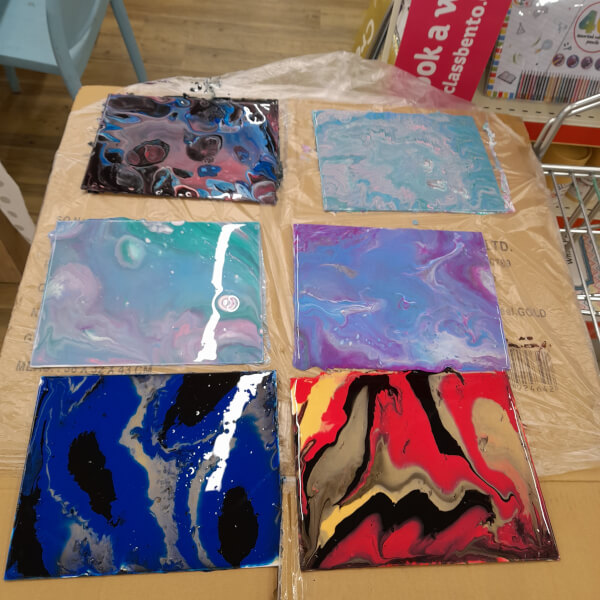
Locate an element on the screen. The height and width of the screenshot is (600, 600). chair is located at coordinates (27, 30).